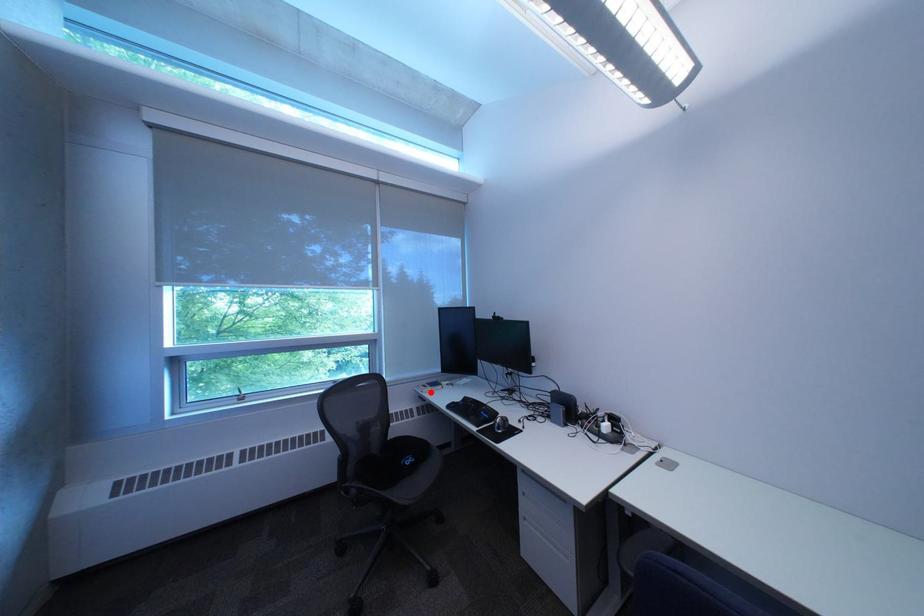
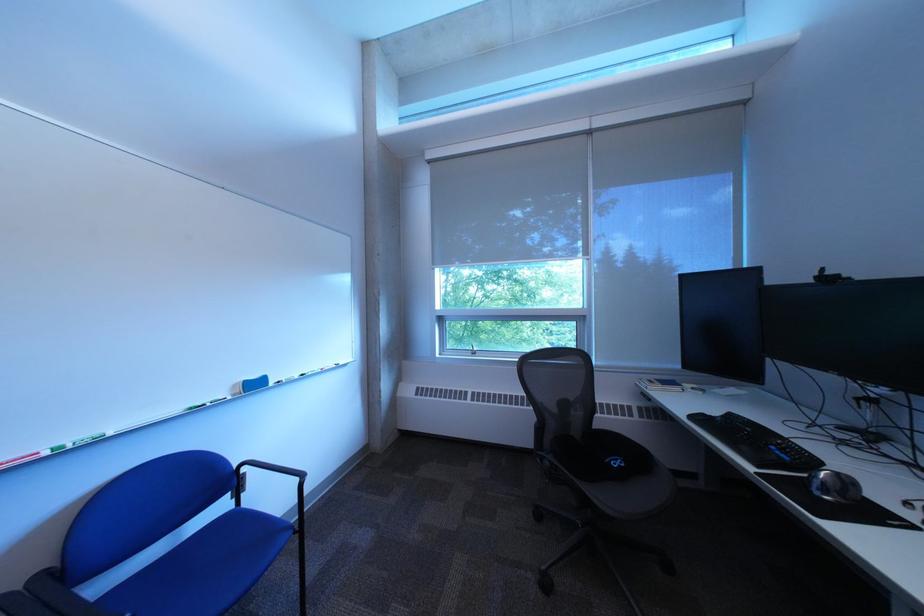
Question: A red point is marked in image1. In image2, is the corresponding 3D point closer to the camera or farther? Reply with the corresponding letter.

Choices:
 (A) The corresponding 3D point is closer.
 (B) The corresponding 3D point is farther.

Answer: (B)